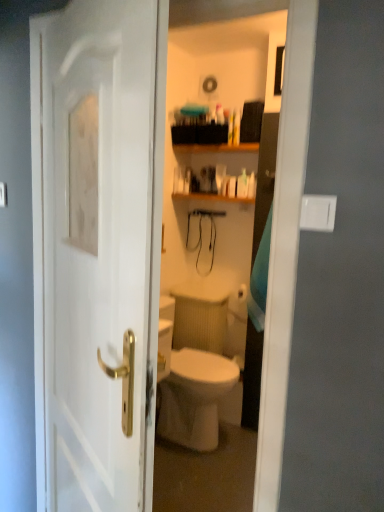
Identify the location of white glossy bottle at upper center. The width and height of the screenshot is (384, 512). (242, 184).

What do you see at coordinates (97, 249) in the screenshot?
I see `white glossy door at center` at bounding box center [97, 249].

This screenshot has width=384, height=512. In order to click on white glossy bottle at upper center in this screenshot , I will do `click(242, 184)`.

Could you tell me if wooden shelf at upper center is turned towards white glossy door at center?

No, wooden shelf at upper center does not turn towards white glossy door at center.

Is wooden shelf at upper center with white glossy door at center?

No, wooden shelf at upper center is not making contact with white glossy door at center.

Is wooden shelf at upper center situated inside white glossy door at center or outside?

The correct answer is: outside.

Which object is thinner, wooden shelf at upper center or white glossy door at center?

With smaller width is white glossy door at center.

Considering the sizes of objects white glossy bottle at upper center and wooden shelf at upper center in the image provided, who is bigger, white glossy bottle at upper center or wooden shelf at upper center?

Bigger between the two is wooden shelf at upper center.

Is white glossy bottle at upper center positioned in front of wooden shelf at upper center?

That is False.

Is white glossy bottle at upper center turned away from wooden shelf at upper center?

No.

From a real-world perspective, between white glossy bottle at upper center and wooden shelf at upper center, who is vertically higher?

In real-world perspective, wooden shelf at upper center is above.

Consider the image. Does white glossy door at center have a lesser height compared to wooden shelf at upper center?

No.

Does white glossy door at center have a smaller size compared to wooden shelf at upper center?

No.

Is white glossy bottle at upper center positioned with its back to white glossy door at center?

No.

Is white glossy bottle at upper center to the left or to the right of white glossy door at center in the image?

white glossy bottle at upper center is to the right of white glossy door at center.

How different are the orientations of white glossy bottle at upper center and white glossy door at center in degrees?

There is a 149-degree angle between the facing directions of white glossy bottle at upper center and white glossy door at center.

Who is shorter, white glossy bottle at upper center or white glossy door at center?

white glossy bottle at upper center.

Between wooden shelf at upper center and white glossy bottle at upper center, which one has larger size?

With larger size is wooden shelf at upper center.

Consider the image. In terms of height, does wooden shelf at upper center look taller or shorter compared to white glossy bottle at upper center?

Considering their sizes, wooden shelf at upper center has less height than white glossy bottle at upper center.

Based on the photo, which is correct: wooden shelf at upper center is inside white glossy bottle at upper center, or outside of it?

wooden shelf at upper center is spatially situated outside white glossy bottle at upper center.

Would you consider white glossy door at center to be distant from white glossy bottle at upper center?

Indeed, white glossy door at center is not near white glossy bottle at upper center.

Is white glossy door at center closer to the viewer compared to white glossy bottle at upper center?

Yes.

From the image's perspective, between white glossy door at center and white glossy bottle at upper center, which one is located above?

From the image's view, white glossy bottle at upper center is above.

Where is `door below the wooden shelf at upper center (from a real-world perspective)`? door below the wooden shelf at upper center (from a real-world perspective) is located at coordinates (97, 249).

The image size is (384, 512). In order to click on toiletry behind the wooden shelf at upper center in this screenshot , I will do `click(242, 184)`.

Looking at the image, which one is located further to white glossy door at center, wooden shelf at upper center or white glossy bottle at upper center?

white glossy bottle at upper center.

Looking at the image, which one is located further to wooden shelf at upper center, white glossy bottle at upper center or white glossy door at center?

white glossy door at center.

From the image, which object appears to be farther from white glossy bottle at upper center, white glossy door at center or wooden shelf at upper center?

white glossy door at center lies further to white glossy bottle at upper center than the other object.

Estimate the real-world distances between objects in this image. Which object is closer to white glossy bottle at upper center, wooden shelf at upper center or white glossy door at center?

Based on the image, wooden shelf at upper center appears to be nearer to white glossy bottle at upper center.

From the image, which object appears to be farther from wooden shelf at upper center, white glossy door at center or white glossy bottle at upper center?

white glossy door at center is positioned further to the anchor wooden shelf at upper center.

Which object lies nearer to the anchor point white glossy door at center, white glossy bottle at upper center or wooden shelf at upper center?

wooden shelf at upper center.

Identify the location of shelf between white glossy door at center and white glossy bottle at upper center in the front-back direction. This screenshot has height=512, width=384. (215, 148).